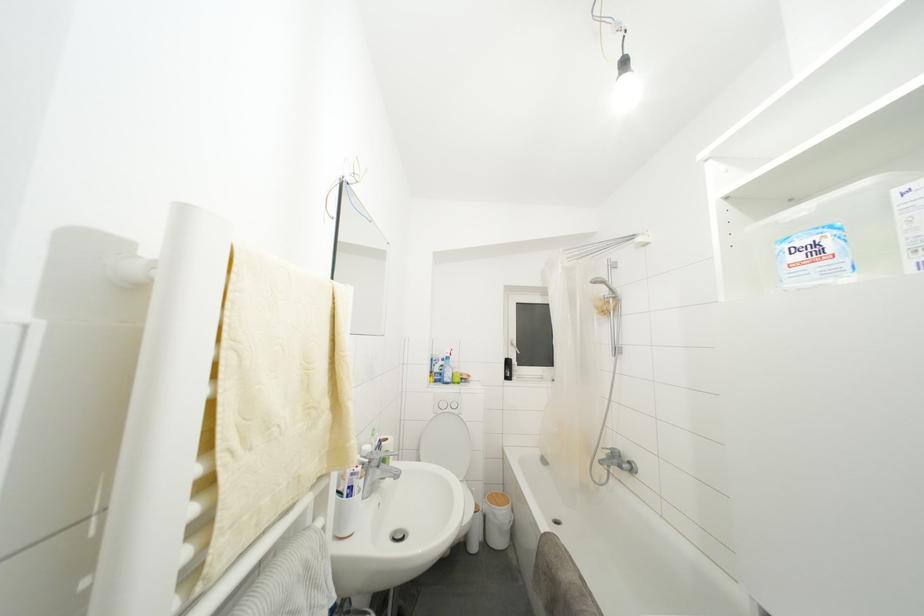
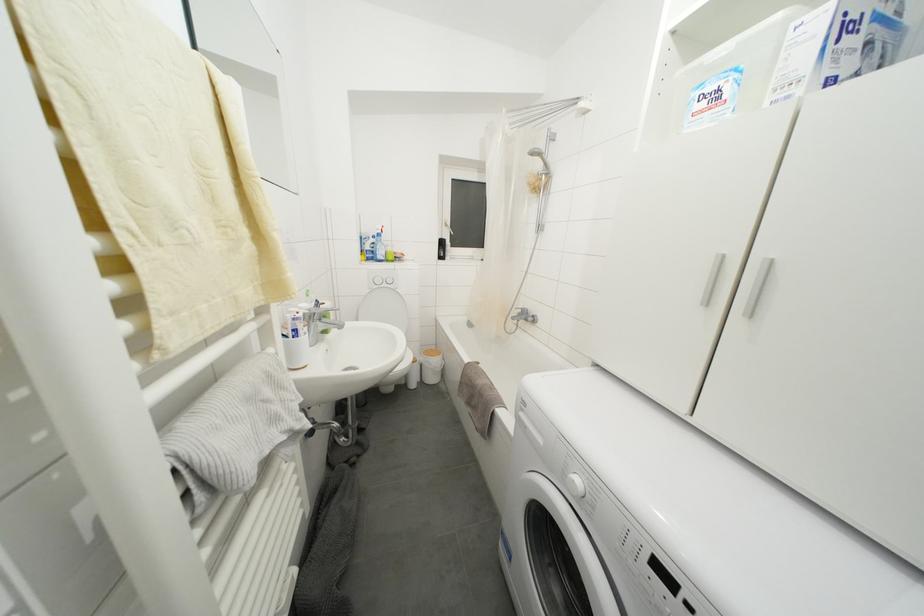
Which direction would the cameraman need to move to produce the second image?

The cameraman moved toward left, backward.